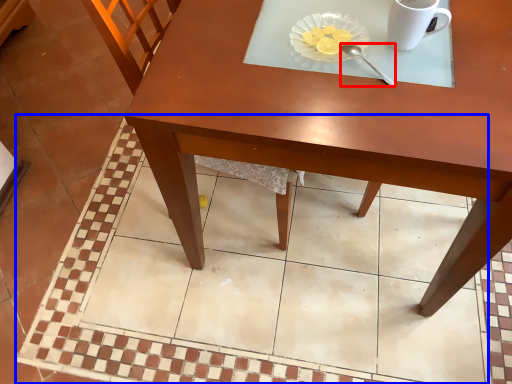
Question: Which object is closer to the camera taking this photo, spoon (highlighted by a red box) or square (highlighted by a blue box)?

Choices:
 (A) spoon
 (B) square

Answer: (A)